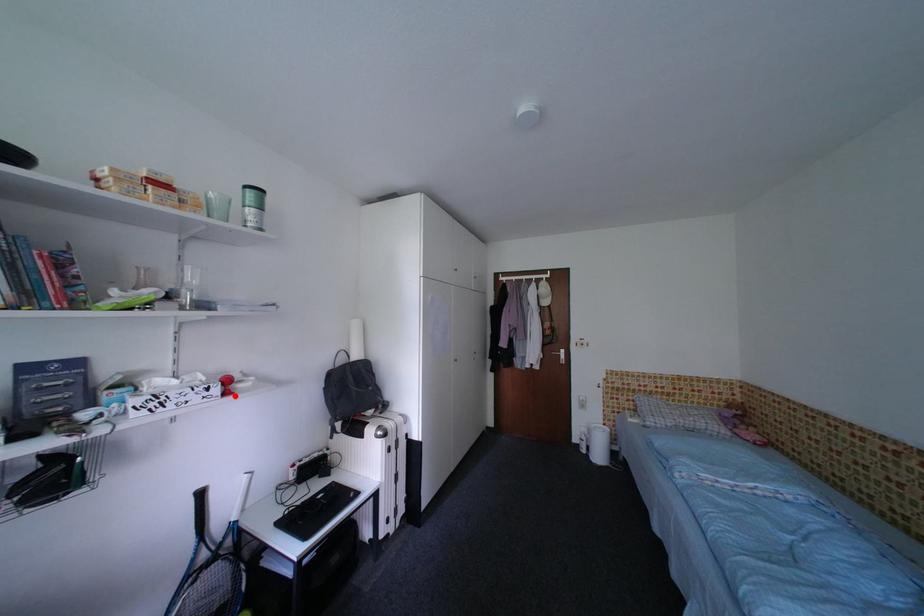
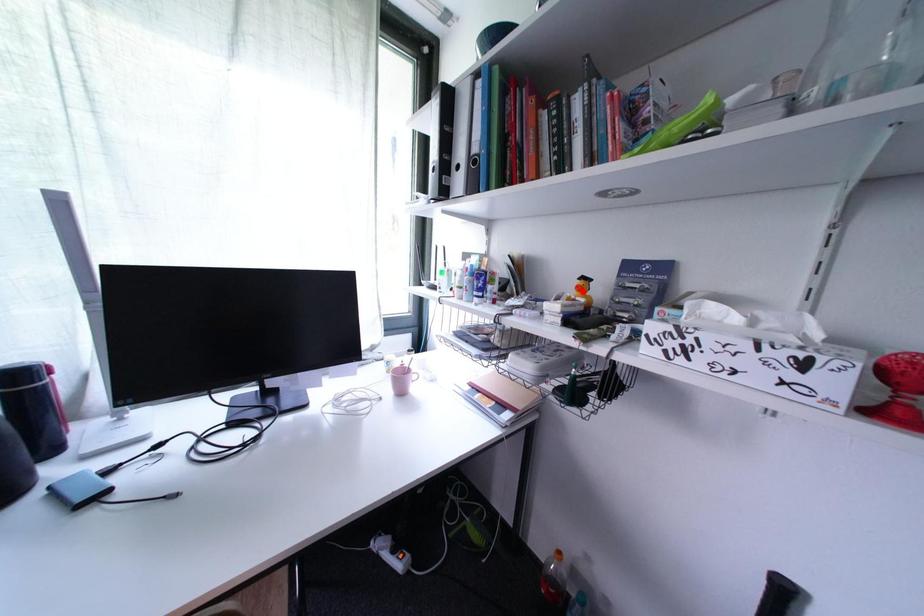
I am providing you with two images of the same scene from different viewpoints. A red point is marked on the first image and another point is marked on the second image. Are the points marked in image1 and image2 representing the same 3D position?

No